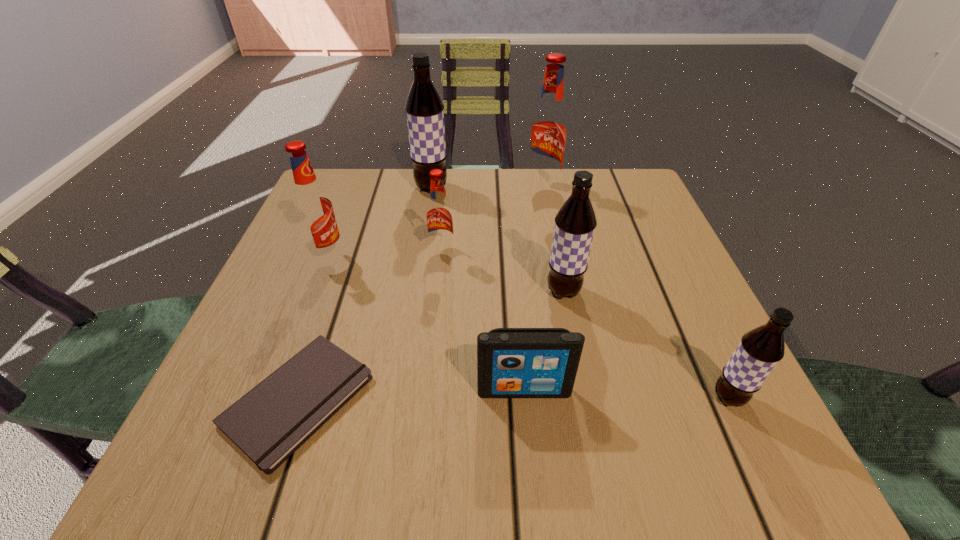
Identify the location of the leftmost brown root beer. (424, 108).

Locate an element on the screen. the farthest brown root beer is located at coordinates (424, 108).

This screenshot has height=540, width=960. Find the location of `the biggest red root beer`. the biggest red root beer is located at coordinates (547, 136).

I want to click on the rightmost red root beer, so click(x=547, y=136).

I want to click on the second farthest brown root beer, so click(575, 223).

Locate an element on the screen. the second biggest brown root beer is located at coordinates (575, 223).

Find the location of a particular element. the leftmost root beer is located at coordinates (312, 206).

You are a GUI agent. You are given a task and a screenshot of the screen. Output one action in this format:
    pyautogui.click(x=<x>, y=<y>)
    Task: Click on the leftmost red root beer
    This screenshot has width=960, height=540.
    Given the screenshot: What is the action you would take?
    pyautogui.click(x=312, y=206)

Image resolution: width=960 pixels, height=540 pixels. I want to click on the second red root beer from left to right, so click(439, 215).

Identify the location of the rightmost brown root beer. This screenshot has width=960, height=540. (759, 351).